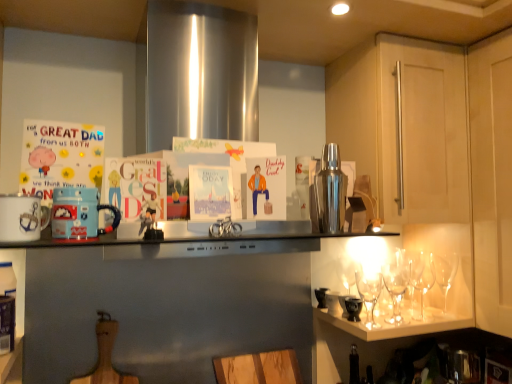
Question: Is matte cardboard postcard at left completely or partially outside of white ceramic mug at left, which is counted as the first appliance, starting from the left?

Choices:
 (A) yes
 (B) no

Answer: (A)

Question: Can you confirm if matte cardboard postcard at left is wider than white ceramic mug at left, positioned as the 2th appliance in front-to-back order?

Choices:
 (A) yes
 (B) no

Answer: (A)

Question: Are matte cardboard postcard at left and white ceramic mug at left, the third appliance positioned from the right, making contact?

Choices:
 (A) no
 (B) yes

Answer: (B)

Question: Is white ceramic mug at left, which ranks as the 2th appliance in back-to-front order, completely or partially inside matte cardboard postcard at left?

Choices:
 (A) yes
 (B) no

Answer: (B)

Question: Does matte cardboard postcard at left come behind white ceramic mug at left, the third appliance positioned from the right?

Choices:
 (A) no
 (B) yes

Answer: (B)

Question: Is white ceramic mug at left, the third appliance positioned from the right, in front of or behind light wood cabinet door at upper right, which is the second cabinetry in front-to-back order, in the image?

Choices:
 (A) front
 (B) behind

Answer: (A)

Question: Is white ceramic mug at left, which is counted as the first appliance, starting from the left, bigger or smaller than light wood cabinet door at upper right, which is the second cabinetry in front-to-back order?

Choices:
 (A) small
 (B) big

Answer: (A)

Question: From the image's perspective, is white ceramic mug at left, which ranks as the 2th appliance in back-to-front order, located above or below light wood cabinet door at upper right, the first cabinetry from the back?

Choices:
 (A) above
 (B) below

Answer: (B)

Question: Which is correct: white ceramic mug at left, positioned as the 2th appliance in front-to-back order, is inside light wood cabinet door at upper right, which is the second cabinetry in front-to-back order, or outside of it?

Choices:
 (A) inside
 (B) outside

Answer: (B)

Question: Considering the positions of light wood cabinet at right, which is the second cabinetry in back-to-front order, and white ceramic mug at left, which ranks as the 2th appliance in back-to-front order, in the image, is light wood cabinet at right, which is the second cabinetry in back-to-front order, wider or thinner than white ceramic mug at left, which ranks as the 2th appliance in back-to-front order,?

Choices:
 (A) wide
 (B) thin

Answer: (A)

Question: Considering the positions of light wood cabinet at right, which is the second cabinetry in back-to-front order, and white ceramic mug at left, which ranks as the 2th appliance in back-to-front order, in the image, is light wood cabinet at right, which is the second cabinetry in back-to-front order, taller or shorter than white ceramic mug at left, which ranks as the 2th appliance in back-to-front order,?

Choices:
 (A) tall
 (B) short

Answer: (A)

Question: Is point (450, 84) closer or farther from the camera than point (1, 230)?

Choices:
 (A) farther
 (B) closer

Answer: (A)

Question: Based on their positions, is light wood cabinet at right, which is the second cabinetry in back-to-front order, located to the left or right of white ceramic mug at left, which is counted as the first appliance, starting from the left?

Choices:
 (A) right
 (B) left

Answer: (A)

Question: Is white ceramic mug at left, which ranks as the 2th appliance in back-to-front order, situated inside wooden cutting board at lower center or outside?

Choices:
 (A) inside
 (B) outside

Answer: (B)

Question: In terms of size, does white ceramic mug at left, the third appliance positioned from the right, appear bigger or smaller than wooden cutting board at lower center?

Choices:
 (A) big
 (B) small

Answer: (B)